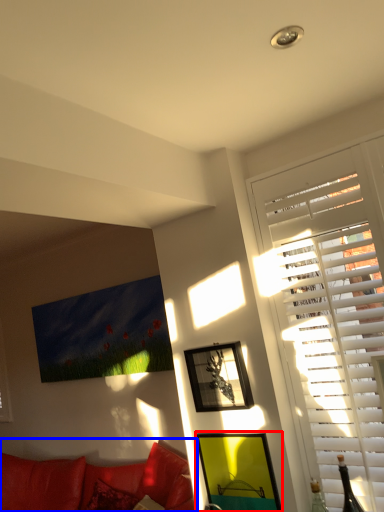
Question: Which point is further to the camera, picture frame (highlighted by a red box) or studio couch (highlighted by a blue box)?

Choices:
 (A) picture frame
 (B) studio couch

Answer: (B)